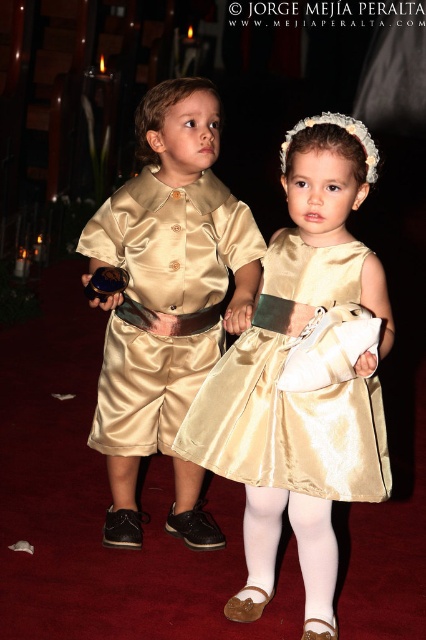
Does point (140, 384) come behind point (328, 403)?

That is True.

Who is shorter, gold satin outfit at center or gold satin dress at center?

gold satin dress at center

Which is behind, point (114, 541) or point (302, 316)?

The point (114, 541) is more distant.

The height and width of the screenshot is (640, 426). In order to click on gold satin outfit at center in this screenshot , I will do `click(166, 285)`.

Can you confirm if gold satin outfit at center is positioned above white satin tights at lower center?

Yes.

Which of these two, gold satin outfit at center or white satin tights at lower center, stands shorter?

Standing shorter between the two is white satin tights at lower center.

Is point (184, 300) closer to camera compared to point (313, 560)?

No, (184, 300) is further to viewer.

You are a GUI agent. You are given a task and a screenshot of the screen. Output one action in this format:
    pyautogui.click(x=<x>, y=<y>)
    Task: Click on the gold satin outfit at center
    This screenshot has height=640, width=426.
    Given the screenshot: What is the action you would take?
    pyautogui.click(x=166, y=285)

Who is positioned more to the left, gold satin dress at center or white satin tights at lower center?

From the viewer's perspective, gold satin dress at center appears more on the left side.

Who is more distant from viewer, (x=267, y=358) or (x=236, y=596)?

Positioned behind is point (x=236, y=596).

The height and width of the screenshot is (640, 426). Find the location of `gold satin dress at center`. gold satin dress at center is located at coordinates (290, 392).

Find the location of a particular element. The height and width of the screenshot is (640, 426). gold satin dress at center is located at coordinates (290, 392).